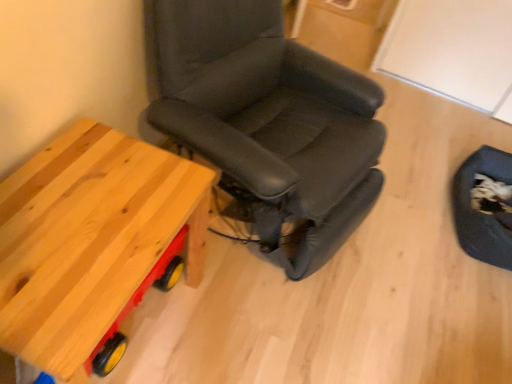
Question: Does point (480, 254) appear closer or farther from the camera than point (10, 211)?

Choices:
 (A) farther
 (B) closer

Answer: (A)

Question: Considering the positions of dark blue fabric swivel chair at lower right and natural wood table at left in the image, is dark blue fabric swivel chair at lower right wider or thinner than natural wood table at left?

Choices:
 (A) thin
 (B) wide

Answer: (A)

Question: Estimate the real-world distances between objects in this image. Which object is farther from the dark blue fabric swivel chair at lower right?

Choices:
 (A) black leather chair at center
 (B) natural wood table at left

Answer: (B)

Question: Estimate the real-world distances between objects in this image. Which object is closer to the dark blue fabric swivel chair at lower right?

Choices:
 (A) black leather chair at center
 (B) natural wood table at left

Answer: (A)